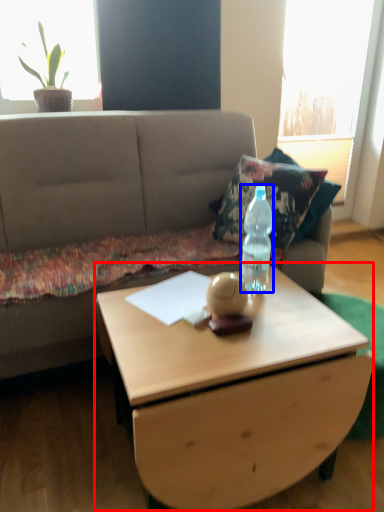
Question: Which point is further to the camera, coffee table (highlighted by a red box) or bottle (highlighted by a blue box)?

Choices:
 (A) coffee table
 (B) bottle

Answer: (B)